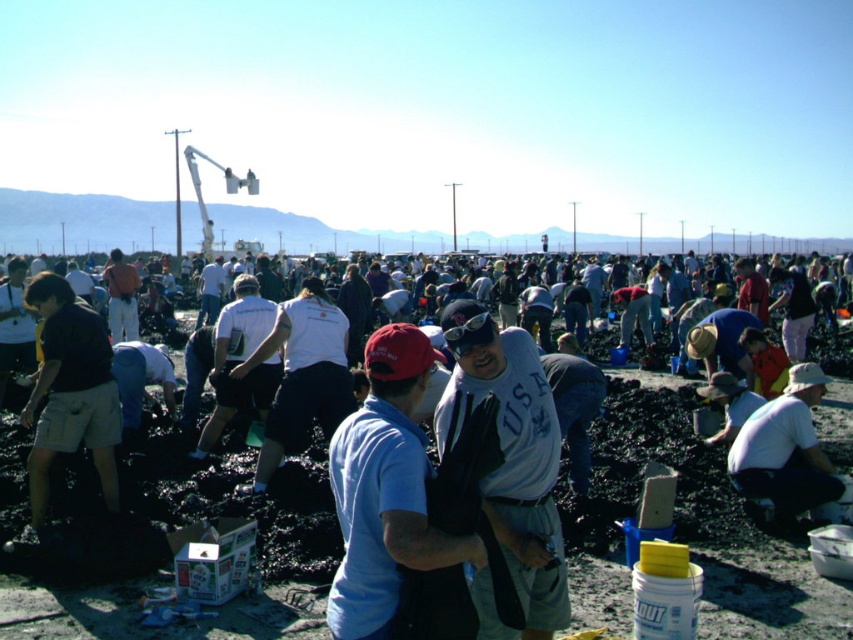
Does matte gray shirt at center come in front of white cotton shirt at lower right?

Yes.

I want to click on matte gray shirt at center, so click(x=167, y=550).

The image size is (853, 640). What do you see at coordinates (167, 550) in the screenshot?
I see `matte gray shirt at center` at bounding box center [167, 550].

Locate an element on the screen. matte gray shirt at center is located at coordinates (167, 550).

Which is below, matte gray shirt at center or gray cotton t-shirt at center?

matte gray shirt at center is below.

Who is more distant from viewer, (x=721, y=577) or (x=515, y=516)?

The point (x=721, y=577) is more distant.

Which is in front, point (326, 579) or point (529, 454)?

Positioned in front is point (529, 454).

Where is `matte gray shirt at center`? matte gray shirt at center is located at coordinates (167, 550).

Is gray cotton t-shirt at center thinner than dark khaki shorts at left?

Yes, gray cotton t-shirt at center is thinner than dark khaki shorts at left.

Which is behind, point (561, 566) or point (50, 401)?

The point (50, 401) is behind.

Where is `gray cotton t-shirt at center`? gray cotton t-shirt at center is located at coordinates (511, 467).